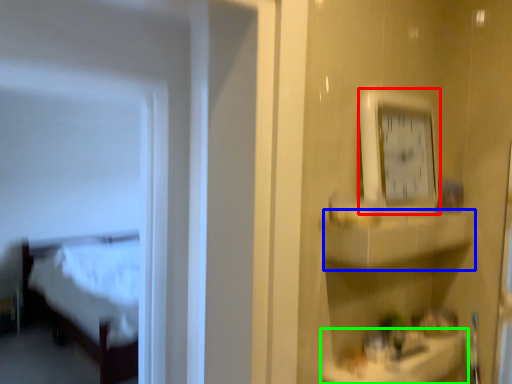
Question: Based on their relative distances, which object is farther from clock (highlighted by a red box)? Choose from cabinet (highlighted by a blue box) and counter top (highlighted by a green box).

Choices:
 (A) cabinet
 (B) counter top

Answer: (B)